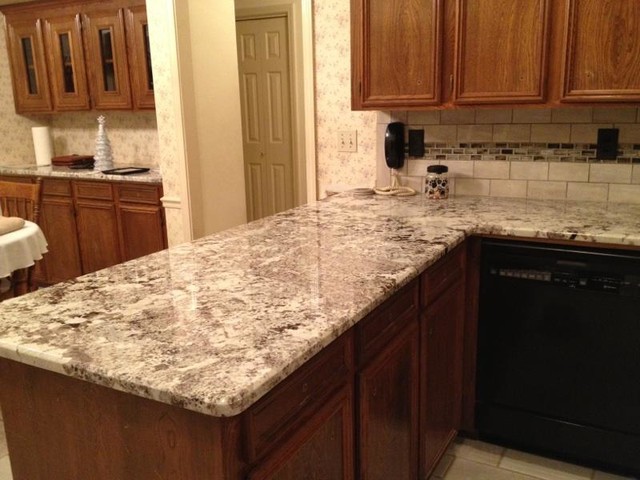
Where is `1 door`? 1 door is located at coordinates (239, 122).